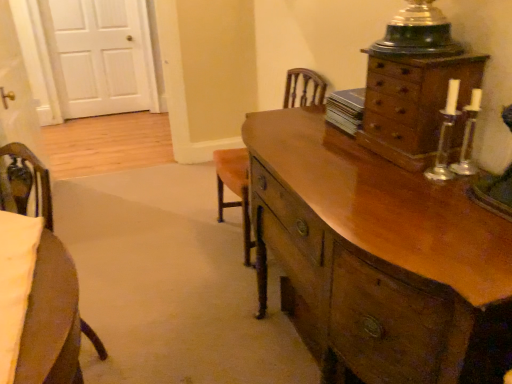
Where is `vacant space situated on the left part of wooden chest of drawers at upper right, the 2th chest of drawers positioned from the bottom`? The height and width of the screenshot is (384, 512). vacant space situated on the left part of wooden chest of drawers at upper right, the 2th chest of drawers positioned from the bottom is located at coordinates (338, 168).